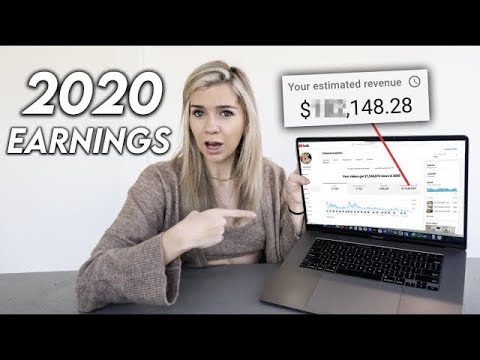
The width and height of the screenshot is (480, 360). What are the coordinates of `keyboard` in the screenshot? It's located at (372, 260).